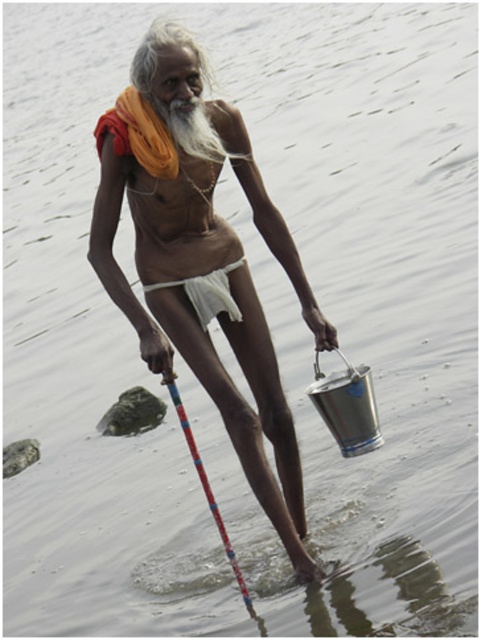
You are a photographer trying to capture the elderly man in the scene. You notice two points marked in the image. The first point is at coordinates point (x=181, y=284) and the second is at point (x=233, y=573). Which point is closer to your camera lens?

Point (x=181, y=284) is further to the camera than point (x=233, y=573). Therefore, point (x=181, y=284) is closer to the camera lens.

You are standing at the point with coordinates point [164,320] and want to walk to point [205,310]. Which direction should you move to get closer to your destination?

You should move away from the viewer because point [164,320] is closer to the viewer than point [205,310].